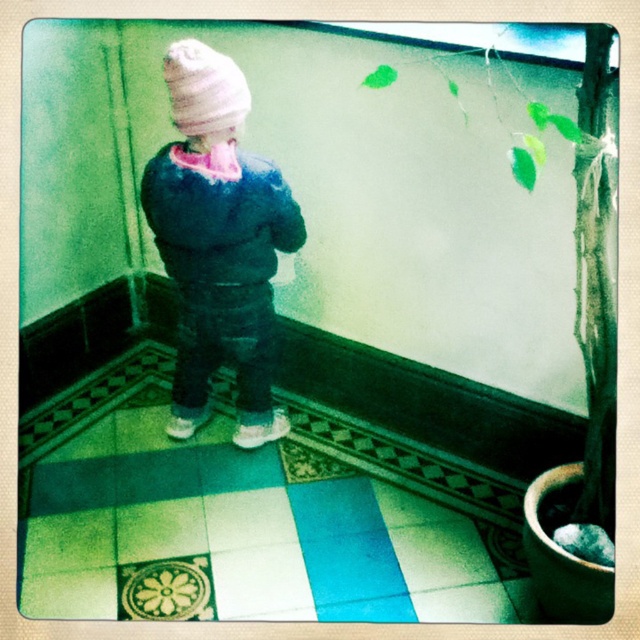
You are a photographer capturing the scene. The child is standing at the center of the room. You want to place a small red stool at the point marked by the coordinates point (218, 241). Will the stool be placed directly in front of the fuzzy blue jacket at center?

The point (218, 241) marks the fuzzy blue jacket at center, so placing the stool there would position it directly in front of the fuzzy blue jacket at center.

You are a fashion designer observing a child wearing a fuzzy blue jacket at center and a white knit hat at upper center. Which clothing item is positioned higher on the child?

The white knit hat at upper center is positioned higher on the child than the fuzzy blue jacket at center.